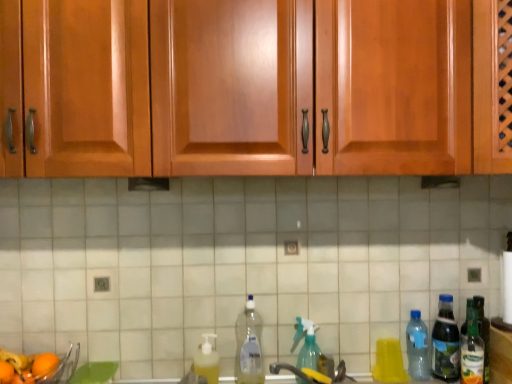
Question: Does green glass bottle at right, which ranks as the 1th bottle in right-to-left order, have a greater width compared to clear plastic bottle at right, which is counted as the fifth bottle, starting from the left?

Choices:
 (A) yes
 (B) no

Answer: (B)

Question: Is green glass bottle at right, which is the 7th bottle in left-to-right order, closer to camera compared to clear plastic bottle at right, which is counted as the fifth bottle, starting from the left?

Choices:
 (A) yes
 (B) no

Answer: (A)

Question: Is green glass bottle at right, which ranks as the 1th bottle in right-to-left order, positioned far away from clear plastic bottle at right, arranged as the 3th bottle when viewed from the right?

Choices:
 (A) yes
 (B) no

Answer: (B)

Question: From a real-world perspective, is green glass bottle at right, which ranks as the 1th bottle in right-to-left order, on top of clear plastic bottle at right, arranged as the 3th bottle when viewed from the right?

Choices:
 (A) yes
 (B) no

Answer: (A)

Question: Considering the relative positions of green glass bottle at right, which ranks as the 1th bottle in right-to-left order, and clear plastic bottle at right, which is counted as the fifth bottle, starting from the left, in the image provided, is green glass bottle at right, which ranks as the 1th bottle in right-to-left order, to the right of clear plastic bottle at right, which is counted as the fifth bottle, starting from the left, from the viewer's perspective?

Choices:
 (A) yes
 (B) no

Answer: (A)

Question: Does green glass bottle at right, which ranks as the 1th bottle in right-to-left order, appear on the left side of clear plastic bottle at right, which is counted as the fifth bottle, starting from the left?

Choices:
 (A) no
 (B) yes

Answer: (A)

Question: Can you confirm if translucent plastic bottle at right, which appears as the 2th bottle when viewed from the right, is smaller than white tile at center?

Choices:
 (A) no
 (B) yes

Answer: (B)

Question: Can you confirm if translucent plastic bottle at right, which appears as the 2th bottle when viewed from the right, is wider than white tile at center?

Choices:
 (A) no
 (B) yes

Answer: (B)

Question: Is translucent plastic bottle at right, which appears as the 2th bottle when viewed from the right, positioned behind white tile at center?

Choices:
 (A) yes
 (B) no

Answer: (B)

Question: Can you confirm if translucent plastic bottle at right, which appears as the 2th bottle when viewed from the right, is shorter than white tile at center?

Choices:
 (A) yes
 (B) no

Answer: (A)

Question: Is translucent plastic bottle at right, acting as the 6th bottle starting from the left, at the right side of white tile at center?

Choices:
 (A) no
 (B) yes

Answer: (B)

Question: Does translucent plastic bottle at right, acting as the 6th bottle starting from the left, have a greater height compared to white tile at center?

Choices:
 (A) yes
 (B) no

Answer: (B)

Question: Does clear plastic bottle at center, the sixth bottle from the right, have a greater height compared to orange matte at lower left, the first orange when ordered from right to left?

Choices:
 (A) yes
 (B) no

Answer: (A)